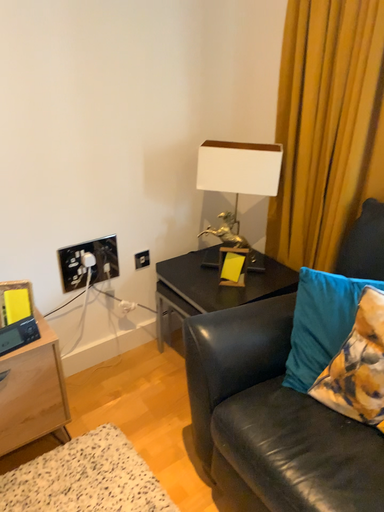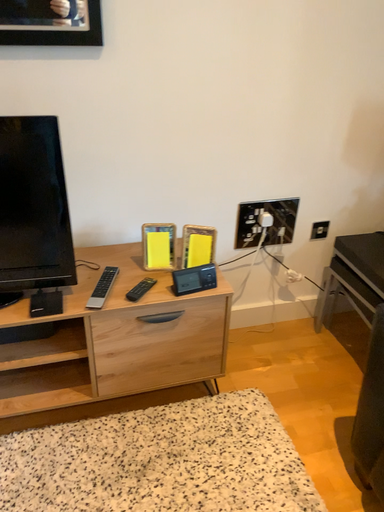
Question: Which way did the camera rotate in the video?

Choices:
 (A) rotated left
 (B) rotated right

Answer: (A)